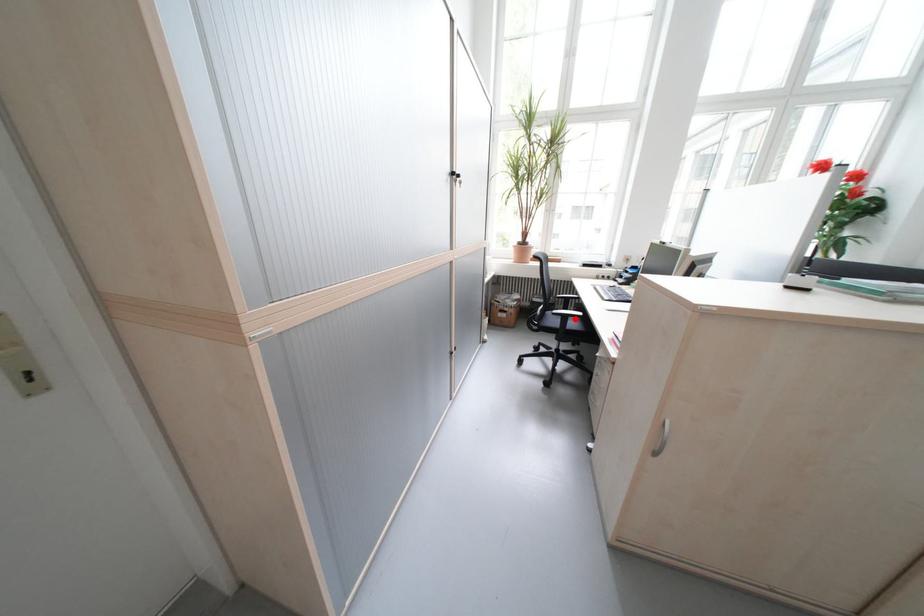
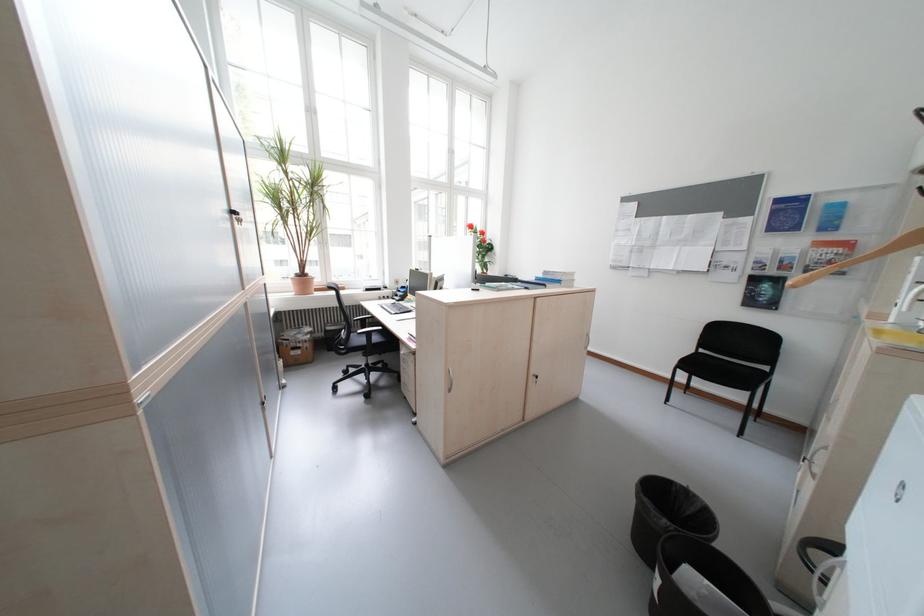
The point at the highlighted location is marked in the first image. Where is the corresponding point in the second image?

(380, 334)